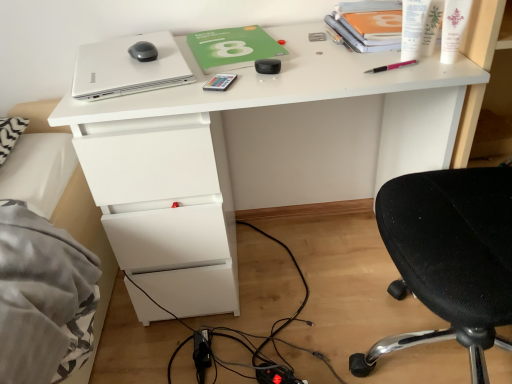
Identify the location of free location in front of white paper towel at upper right, which appears as the first stationery when viewed from the right. (434, 69).